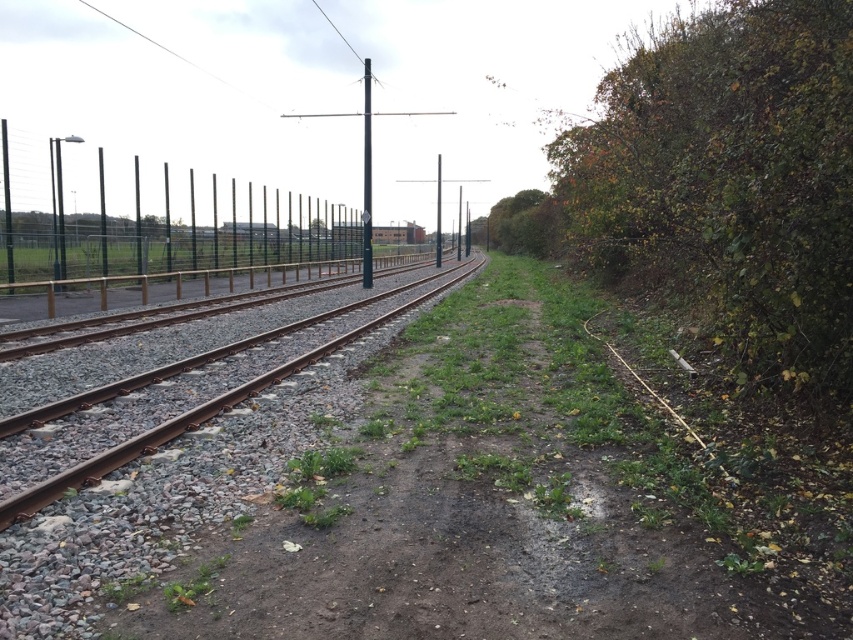
You are standing at the point with coordinates point (x=440, y=256) and want to walk to the point with coordinates point (x=53, y=234). Which direction should you move relative to the railway tracks?

You should move towards the direction of the railway tracks because point (x=53, y=234) is in front of point (x=440, y=256) along the tracks.